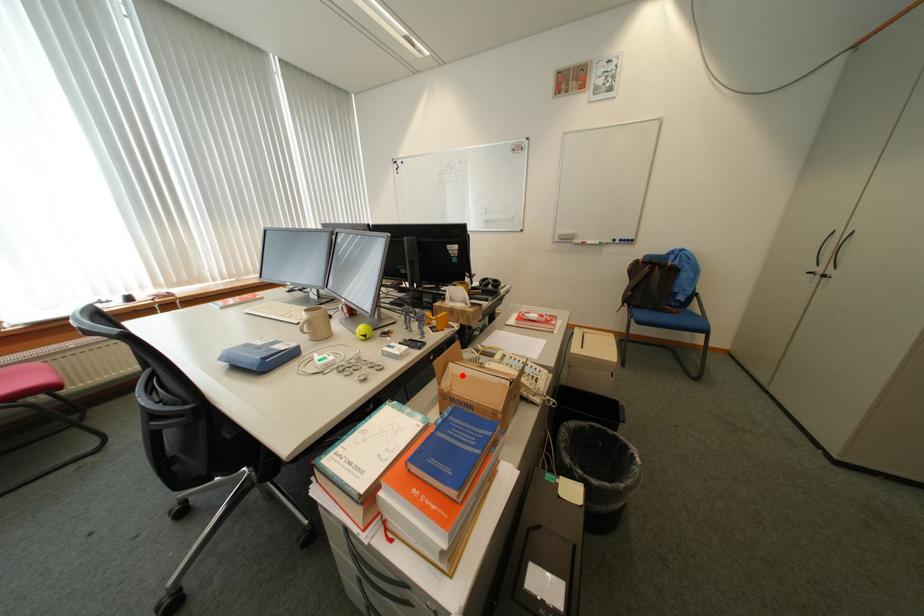
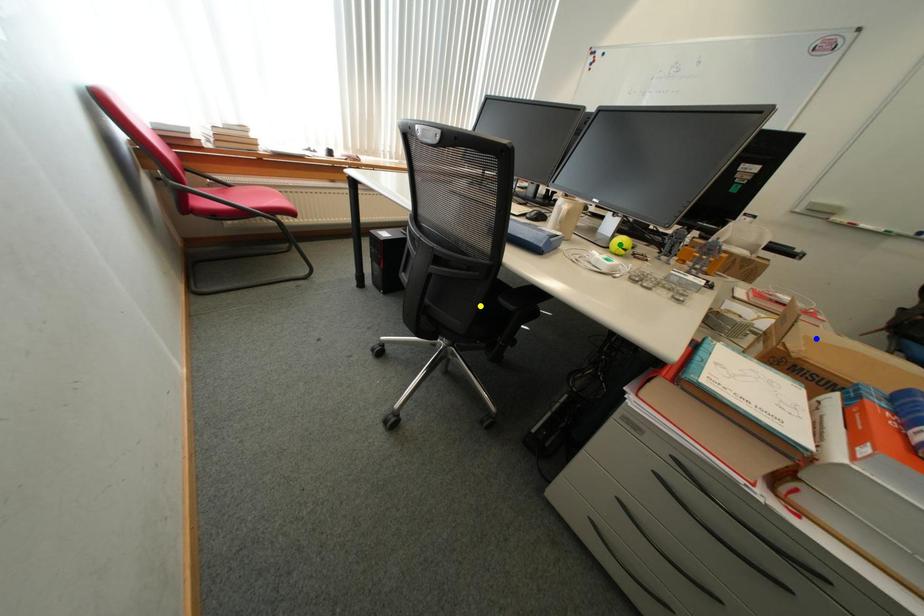
Question: I am providing you with two images of the same scene from different viewpoints. A red point is marked on the first image. You are given multiple points on the second image. Which point in image 2 is actually the same real-world point as the red point in image 1?

Choices:
 (A) yellow point
 (B) green point
 (C) blue point

Answer: (C)